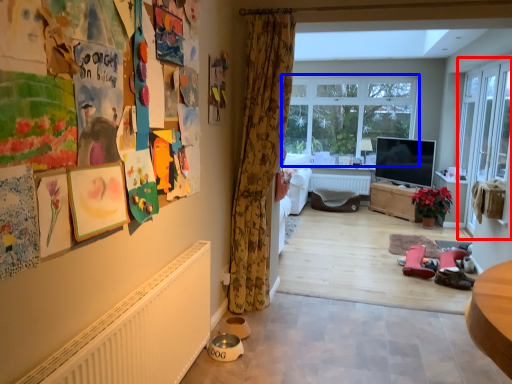
Question: Which point is further to the camera, screen door (highlighted by a red box) or window (highlighted by a blue box)?

Choices:
 (A) screen door
 (B) window

Answer: (B)